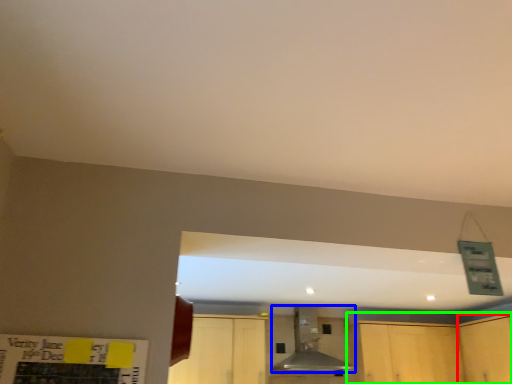
Question: Which object is the farthest from cabinetry (highlighted by a red box)? Choose among these: vent (highlighted by a blue box) or cabinetry (highlighted by a green box).

Choices:
 (A) vent
 (B) cabinetry

Answer: (A)